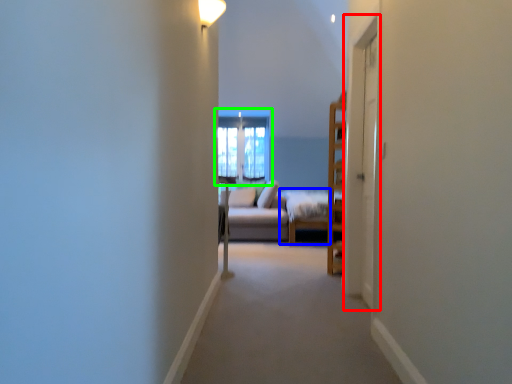
Question: Considering the real-world distances, which object is closest to screen door (highlighted by a red box)? bed frame (highlighted by a blue box) or window (highlighted by a green box).

Choices:
 (A) bed frame
 (B) window

Answer: (A)